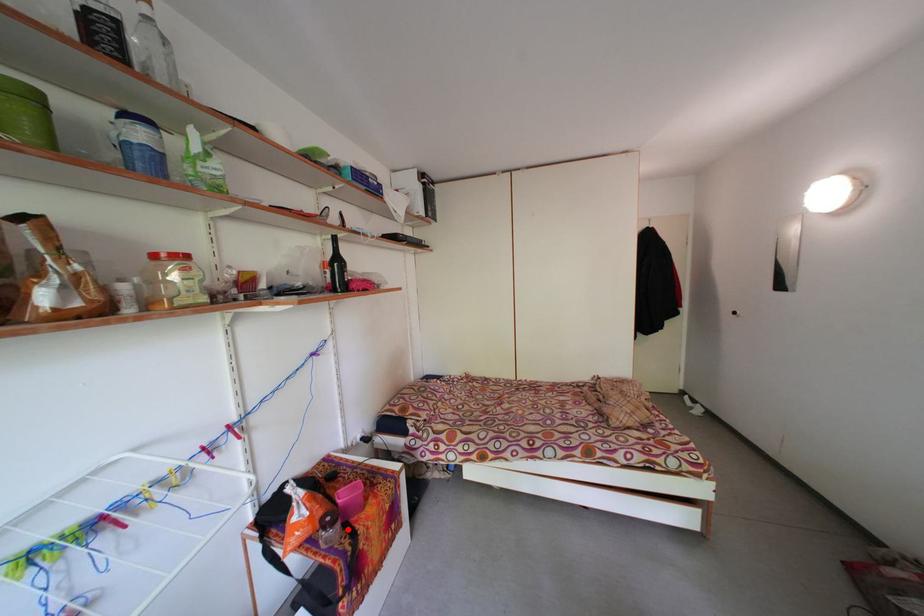
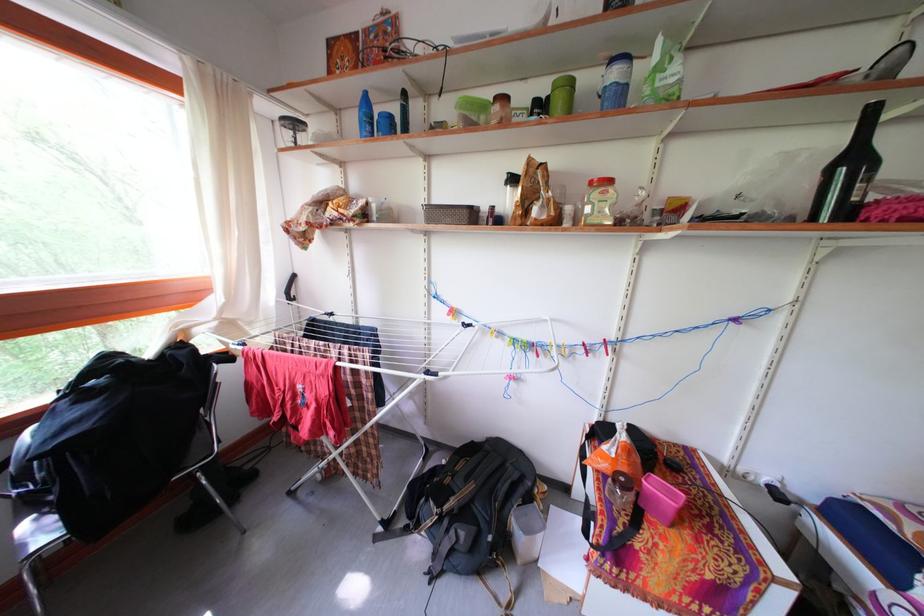
Locate, in the second image, the point that corresponds to the highlighted location in the first image.

(638, 504)